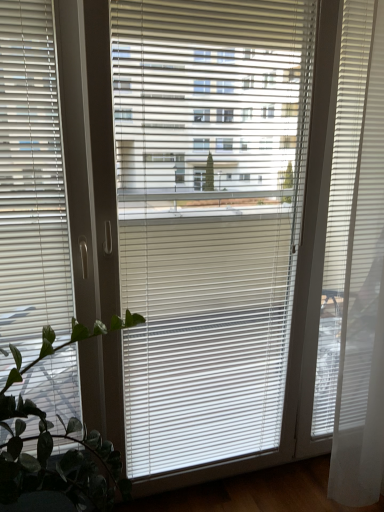
The width and height of the screenshot is (384, 512). What do you see at coordinates (32, 183) in the screenshot?
I see `white matte blinds at left` at bounding box center [32, 183].

Locate an element on the screen. white matte blinds at left is located at coordinates (32, 183).

You are a GUI agent. You are given a task and a screenshot of the screen. Output one action in this format:
    pyautogui.click(x=<x>, y=<y>)
    Task: Click on the white matte blinds at left
    Image resolution: width=384 pixels, height=512 pixels.
    Given the screenshot: What is the action you would take?
    pyautogui.click(x=32, y=183)